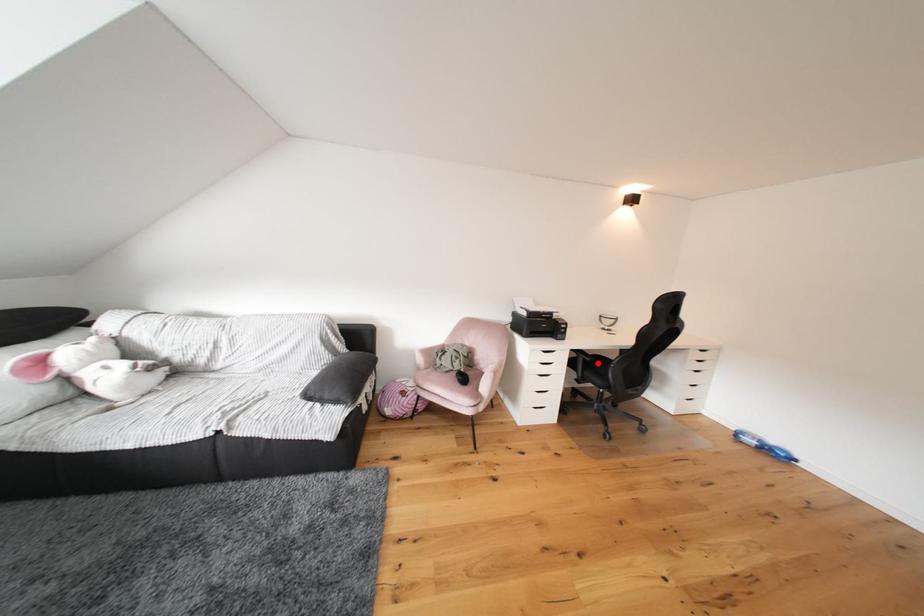
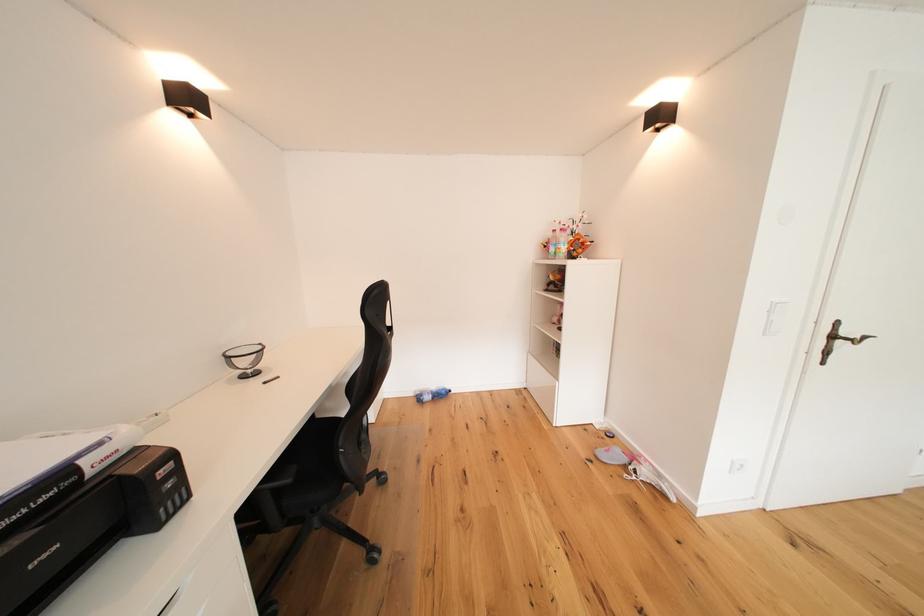
Where in the second image is the point corresponding to the highlighted location from the first image?

(298, 485)